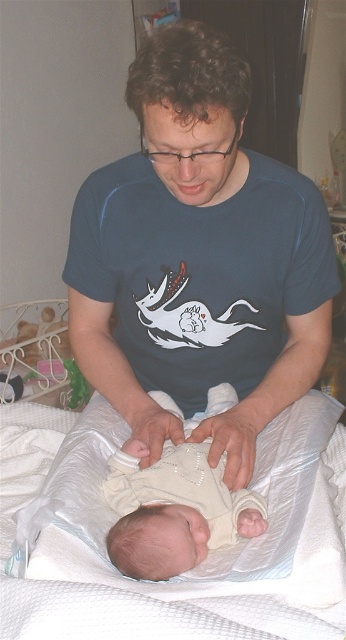
What object is located at the coordinates point (197, 259) in the image?

The point (197, 259) marks the blue cotton shirt at center.

In the scene where a man is attending to a baby on a white blanket, there is a point at coordinates (197, 259). What object is located at this point?

The point at coordinates (197, 259) corresponds to the blue cotton shirt at center.